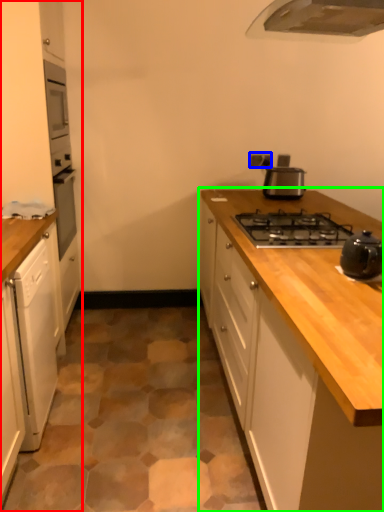
Question: Based on their relative distances, which object is farther from cabinetry (highlighted by a red box)? Choose from electric outlet (highlighted by a blue box) and cabinetry (highlighted by a green box).

Choices:
 (A) electric outlet
 (B) cabinetry

Answer: (A)